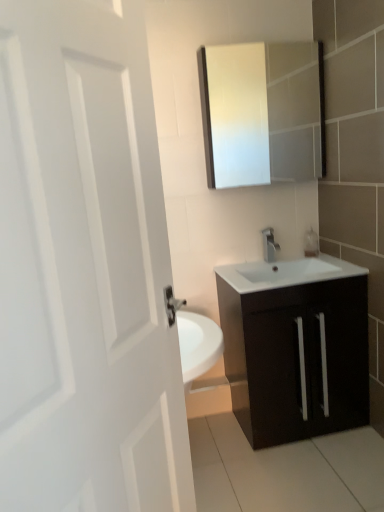
The width and height of the screenshot is (384, 512). What are the coordinates of `free space above matte dark wood cabinet at lower right (from a real-world perspective)` in the screenshot? It's located at [x=299, y=268].